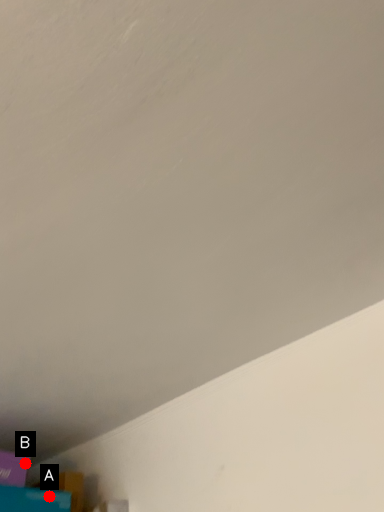
Question: Two points are circled on the image, labeled by A and B beside each circle. Which of the following is the farthest from the observer?

Choices:
 (A) A is further
 (B) B is further

Answer: (B)